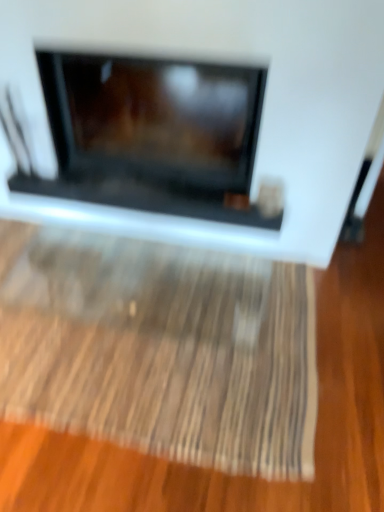
At what (x,y) coordinates should I click in order to perform the action: click on vacant space that's between matte black fireplace at center and wooden textured mat at center. Please return your answer as a coordinate pair (x, y). The width and height of the screenshot is (384, 512). Looking at the image, I should click on (319, 330).